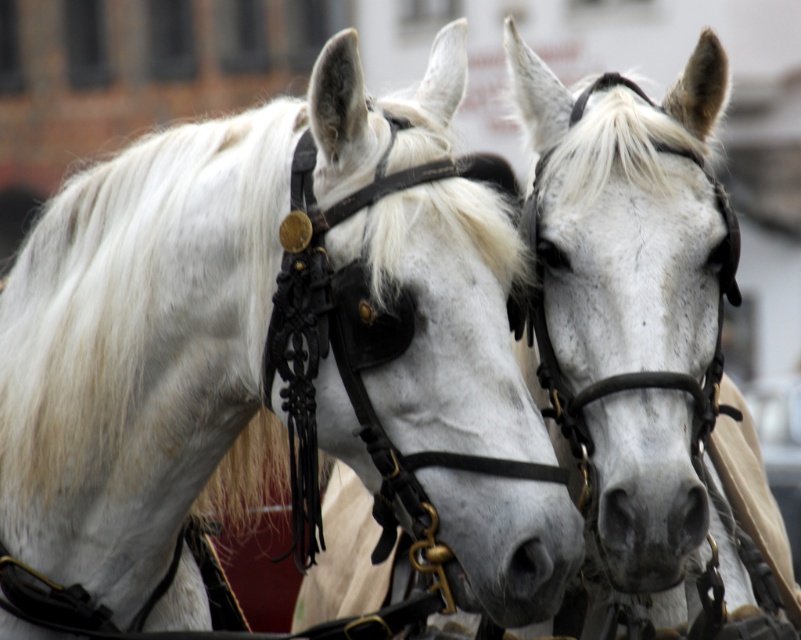
This screenshot has height=640, width=801. Describe the element at coordinates (268, 355) in the screenshot. I see `white matte horse at center` at that location.

Is white matte horse at center shorter than white leather bridle at center?

Yes.

Identify the location of white matte horse at center. Image resolution: width=801 pixels, height=640 pixels. (268, 355).

Who is higher up, white matte horse at center or gray matte nose at center?

Positioned higher is white matte horse at center.

Between white matte horse at center and gray matte nose at center, which one has less height?

gray matte nose at center is shorter.

Is point (457, 228) closer to camera compared to point (528, 564)?

No, it is not.

What are the coordinates of `white matte horse at center` in the screenshot? It's located at (268, 355).

Is white leather bridle at center positioned at the back of gray matte nose at center?

Yes, white leather bridle at center is behind gray matte nose at center.

Is point (570, 100) positioned behind point (541, 561)?

Yes, it is behind point (541, 561).

I want to click on white leather bridle at center, so [x=643, y=355].